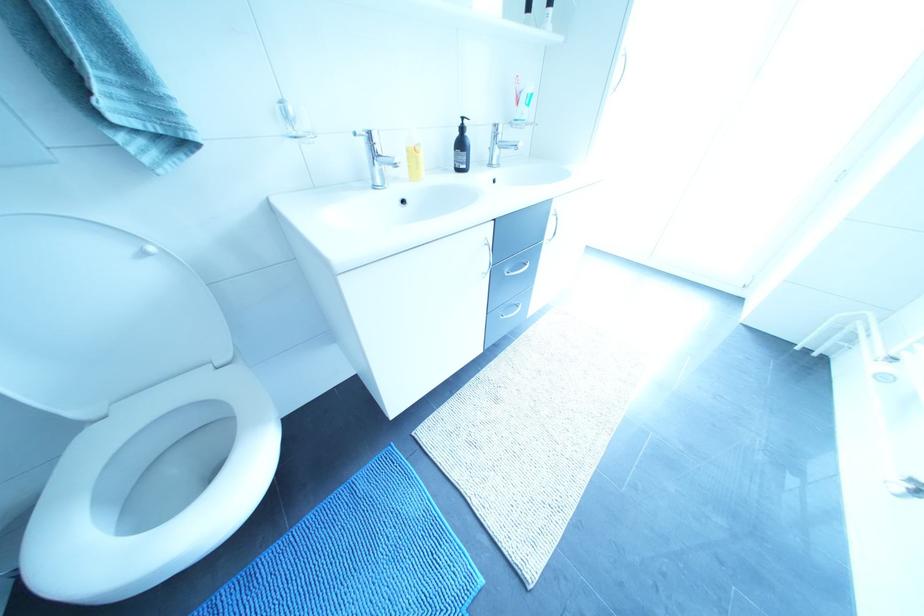
Where would you squeez the yellow soap bottle? Please return your answer as a coordinate pair (x, y).

(415, 156)